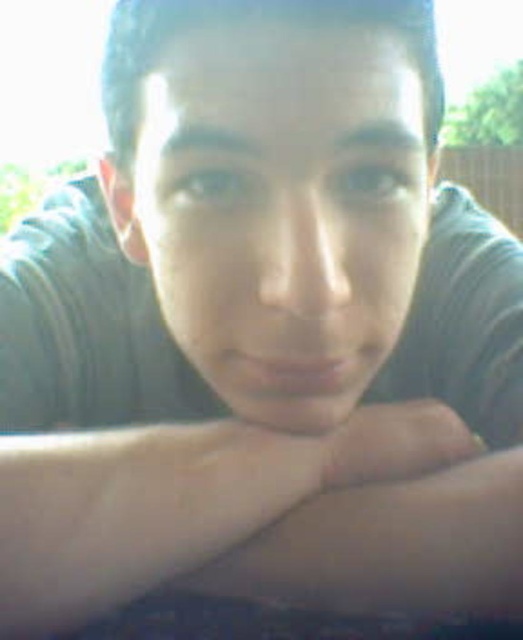
Does skinny white arm at center have a greater height compared to smooth skin at center?

Indeed, skinny white arm at center has a greater height compared to smooth skin at center.

Between skinny white arm at center and smooth skin at center, which one is positioned lower?

skinny white arm at center is lower down.

This screenshot has height=640, width=523. Find the location of `skinny white arm at center`. skinny white arm at center is located at coordinates (177, 499).